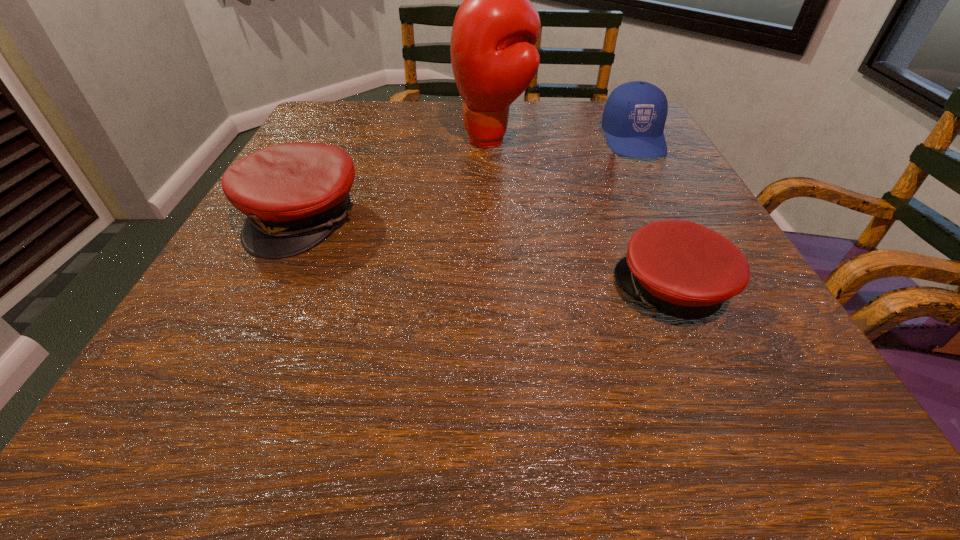
This screenshot has width=960, height=540. Find the location of `vacant region that satisfies the following two spatial constraints: 1. on the striking surface of the boxing glove; 2. on the front of the leftmost object with an emblem`. vacant region that satisfies the following two spatial constraints: 1. on the striking surface of the boxing glove; 2. on the front of the leftmost object with an emblem is located at coordinates [496, 218].

Image resolution: width=960 pixels, height=540 pixels. I want to click on vacant point that satisfies the following two spatial constraints: 1. on the striking surface of the tallest object; 2. on the front of the leftmost cap with an emblem, so click(496, 218).

The width and height of the screenshot is (960, 540). In order to click on free space that satisfies the following two spatial constraints: 1. on the front-facing side of the farthest cap; 2. on the front-facing side of the shortest object in this screenshot , I will do pyautogui.click(x=713, y=291).